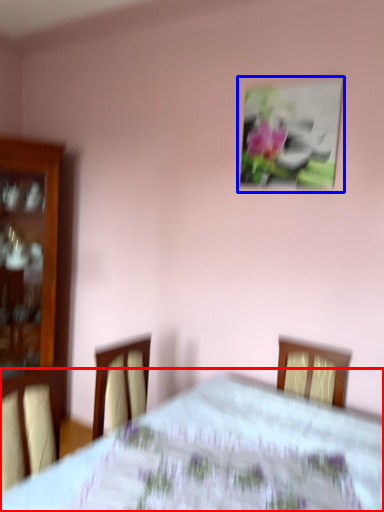
Question: Which object appears farthest to the camera in this image, bed (highlighted by a red box) or picture frame (highlighted by a blue box)?

Choices:
 (A) bed
 (B) picture frame

Answer: (B)